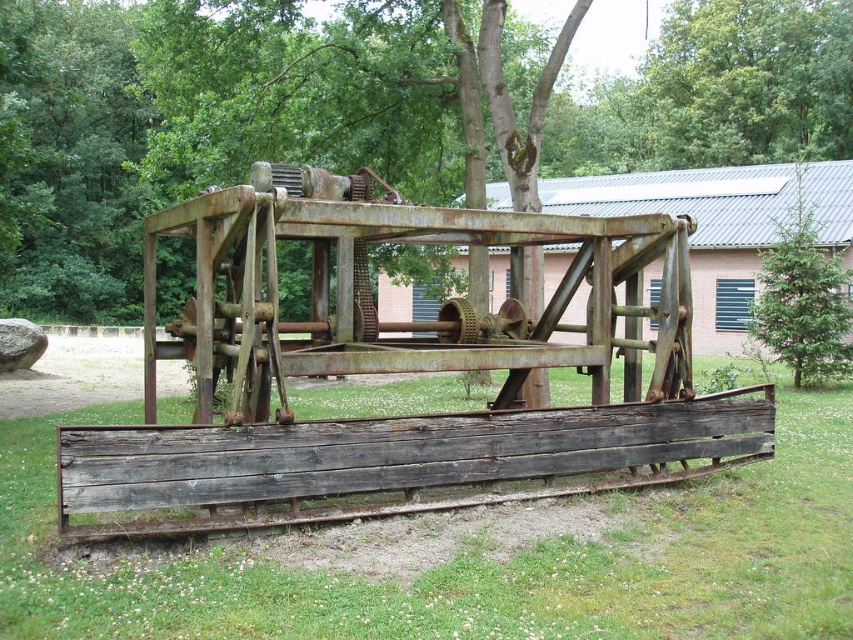
Question: Which point is closer to the camera?

Choices:
 (A) click(387, 561)
 (B) click(770, 301)
 (C) click(759, 84)

Answer: (A)

Question: Which object appears closest to the camera in this image?

Choices:
 (A) green textured pine tree at center
 (B) green leafy tree at upper center

Answer: (A)

Question: Does weathered wood at center appear on the right side of green textured pine tree at center?

Choices:
 (A) yes
 (B) no

Answer: (B)

Question: Can you confirm if green leafy tree at upper center is positioned to the left of green textured pine tree at center?

Choices:
 (A) yes
 (B) no

Answer: (B)

Question: Which of the following is the farthest from the observer?

Choices:
 (A) green leafy tree at upper center
 (B) weathered wood at center

Answer: (A)

Question: Can you confirm if green leafy tree at upper center is positioned to the left of green textured pine tree at center?

Choices:
 (A) no
 (B) yes

Answer: (A)